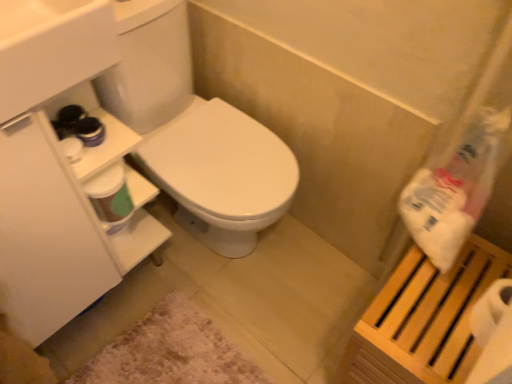
This screenshot has width=512, height=384. Describe the element at coordinates (454, 190) in the screenshot. I see `white plastic bag at upper right` at that location.

Describe the element at coordinates (51, 49) in the screenshot. I see `white glossy sink at upper left` at that location.

At what (x,y) coordinates should I click in order to perform the action: click on white fluffy bath mat at lower center. Please return your answer as a coordinate pair (x, y). Looking at the image, I should click on (170, 351).

Where is `white plastic bag at upper right`? The image size is (512, 384). white plastic bag at upper right is located at coordinates (454, 190).

Is white glossy sink at upper left spatially inside white matte toilet paper at right, or outside of it?

white glossy sink at upper left is not inside white matte toilet paper at right, it's outside.

Which object is thinner, white glossy sink at upper left or white matte toilet paper at right?

With smaller width is white matte toilet paper at right.

Considering the sizes of white glossy sink at upper left and white matte toilet paper at right in the image, is white glossy sink at upper left bigger or smaller than white matte toilet paper at right?

Clearly, white glossy sink at upper left is larger in size than white matte toilet paper at right.

Which point is more forward, (33, 23) or (474, 329)?

The point (474, 329) is in front.

How different are the orientations of white fluffy bath mat at lower center and white matte toilet paper at right in degrees?

179 degrees.

Which of these two, white fluffy bath mat at lower center or white matte toilet paper at right, is thinner?

With smaller width is white matte toilet paper at right.

Locate an element on the screen. bath mat behind the white matte toilet paper at right is located at coordinates (170, 351).

Considering the relative sizes of white glossy sink at upper left and white plastic bag at upper right in the image provided, is white glossy sink at upper left smaller than white plastic bag at upper right?

Incorrect, white glossy sink at upper left is not smaller in size than white plastic bag at upper right.

Is white glossy sink at upper left looking in the opposite direction of white plastic bag at upper right?

No, white glossy sink at upper left is not facing the opposite direction of white plastic bag at upper right.

Is point (94, 16) farther from viewer compared to point (424, 246)?

No, (94, 16) is closer to viewer.

Is white glossy sink at upper left in front of or behind white plastic bag at upper right in the image?

white glossy sink at upper left is positioned closer to the viewer than white plastic bag at upper right.

Which of these two, wooden slatted shelf at right or white plastic bag at upper right, is thinner?

white plastic bag at upper right.

Can you tell me how much wooden slatted shelf at right and white plastic bag at upper right differ in facing direction?

They differ by 0.000383 degrees in their facing directions.

From a real-world perspective, is wooden slatted shelf at right on top of white plastic bag at upper right?

No.

Would you say wooden slatted shelf at right is a long distance from white plastic bag at upper right?

No, wooden slatted shelf at right is not far from white plastic bag at upper right.

Is white fluffy bath mat at lower center far from white plastic bag at upper right?

white fluffy bath mat at lower center is actually quite close to white plastic bag at upper right.

Looking at this image, is white fluffy bath mat at lower center not inside white plastic bag at upper right?

white fluffy bath mat at lower center is positioned outside white plastic bag at upper right.

Does point (193, 307) appear closer or farther from the camera than point (461, 206)?

Point (193, 307).

Is white fluffy bath mat at lower center at the left side of white plastic bag at upper right?

Indeed, white fluffy bath mat at lower center is positioned on the left side of white plastic bag at upper right.

I want to click on cleaning product above the white matte toilet paper at right (from the image's perspective), so click(454, 190).

Can you confirm if white matte toilet paper at right is positioned to the left of white plastic bag at upper right?

No.

How many degrees apart are the facing directions of white matte toilet paper at right and white plastic bag at upper right?

There is a 0.00105-degree angle between the facing directions of white matte toilet paper at right and white plastic bag at upper right.

How much distance is there between wooden slatted shelf at right and white matte toilet paper at right?

wooden slatted shelf at right is 4.98 inches from white matte toilet paper at right.

Considering the relative positions of wooden slatted shelf at right and white matte toilet paper at right in the image provided, is wooden slatted shelf at right to the left or to the right of white matte toilet paper at right?

In the image, wooden slatted shelf at right appears on the left side of white matte toilet paper at right.

Based on the photo, is wooden slatted shelf at right next to white matte toilet paper at right and touching it?

No, wooden slatted shelf at right is not with white matte toilet paper at right.

Is the depth of wooden slatted shelf at right greater than that of white matte toilet paper at right?

Yes, it is behind white matte toilet paper at right.

Where is `toilet paper behind the white glossy sink at upper left`? This screenshot has width=512, height=384. toilet paper behind the white glossy sink at upper left is located at coordinates (493, 335).

The image size is (512, 384). In the image, there is a white fluffy bath mat at lower center. In order to click on toilet paper above it (from the image's perspective) in this screenshot , I will do `click(493, 335)`.

Which object lies further to the anchor point white fluffy bath mat at lower center, wooden slatted shelf at right or white glossy sink at upper left?

Among the two, white glossy sink at upper left is located further to white fluffy bath mat at lower center.

From the image, which object appears to be farther from white glossy sink at upper left, white plastic bag at upper right or wooden slatted shelf at right?

wooden slatted shelf at right lies further to white glossy sink at upper left than the other object.

When comparing their distances from white fluffy bath mat at lower center, does wooden slatted shelf at right or white matte toilet paper at right seem further?

white matte toilet paper at right.

Looking at the image, which one is located further to white fluffy bath mat at lower center, white glossy sink at upper left or white matte toilet paper at right?

white glossy sink at upper left.

From the image, which object appears to be farther from white glossy sink at upper left, white plastic bag at upper right or white matte toilet paper at right?

white matte toilet paper at right lies further to white glossy sink at upper left than the other object.

Estimate the real-world distances between objects in this image. Which object is closer to white matte toilet paper at right, white glossy sink at upper left or white fluffy bath mat at lower center?

The object closer to white matte toilet paper at right is white fluffy bath mat at lower center.

Considering their positions, is white fluffy bath mat at lower center positioned further to wooden slatted shelf at right than white matte toilet paper at right?

white fluffy bath mat at lower center is further to wooden slatted shelf at right.

Looking at this image, from the image, which object appears to be farther from white fluffy bath mat at lower center, white glossy sink at upper left or white plastic bag at upper right?

white glossy sink at upper left is positioned further to the anchor white fluffy bath mat at lower center.

You are a GUI agent. You are given a task and a screenshot of the screen. Output one action in this format:
    pyautogui.click(x=<x>, y=<y>)
    Task: Click on the cleaning product between white fluffy bath mat at lower center and wooden slatted shelf at right in the horizontal direction
    
    Given the screenshot: What is the action you would take?
    pyautogui.click(x=454, y=190)

The image size is (512, 384). In order to click on cleaning product between white glossy sink at upper left and wooden slatted shelf at right in the horizontal direction in this screenshot , I will do `click(454, 190)`.

Identify the location of cleaning product between white fluffy bath mat at lower center and white matte toilet paper at right. Image resolution: width=512 pixels, height=384 pixels. (454, 190).

Find the location of `bath mat situated between white glossy sink at upper left and wooden slatted shelf at right from left to right`. bath mat situated between white glossy sink at upper left and wooden slatted shelf at right from left to right is located at coordinates (170, 351).